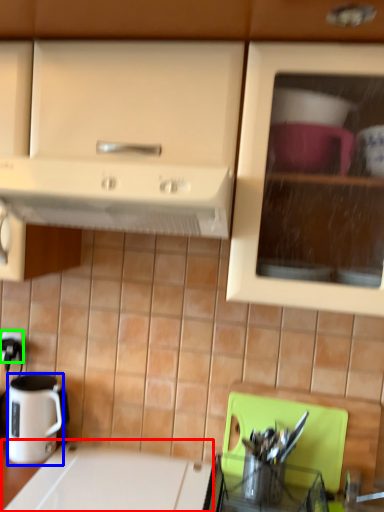
Question: Estimate the real-world distances between objects in this image. Which object is closer to counter top (highlighted by a red box), coffee cup (highlighted by a blue box) or electric outlet (highlighted by a green box)?

Choices:
 (A) coffee cup
 (B) electric outlet

Answer: (A)